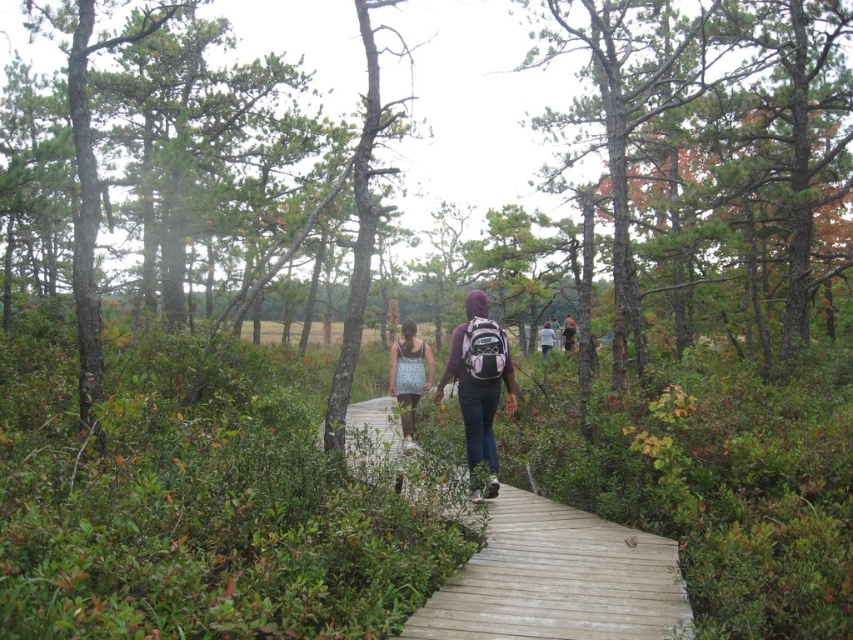
Consider the image. Is purple fleece jacket at center shorter than pink backpack at center?

No, purple fleece jacket at center is not shorter than pink backpack at center.

Which is more to the right, purple fleece jacket at center or pink backpack at center?

pink backpack at center is more to the right.

This screenshot has width=853, height=640. I want to click on purple fleece jacket at center, so click(479, 381).

Does wooden at center have a lesser width compared to purple fleece jacket at center?

In fact, wooden at center might be wider than purple fleece jacket at center.

The image size is (853, 640). What do you see at coordinates (558, 579) in the screenshot?
I see `wooden at center` at bounding box center [558, 579].

I want to click on wooden at center, so click(558, 579).

Does patterned fabric dress at center appear on the right side of pink backpack at center?

No, patterned fabric dress at center is not to the right of pink backpack at center.

Does patterned fabric dress at center have a lesser width compared to pink backpack at center?

No, patterned fabric dress at center is not thinner than pink backpack at center.

You are a GUI agent. You are given a task and a screenshot of the screen. Output one action in this format:
    pyautogui.click(x=<x>, y=<y>)
    Task: Click on the patterned fabric dress at center
    The width and height of the screenshot is (853, 640).
    Given the screenshot: What is the action you would take?
    pyautogui.click(x=409, y=376)